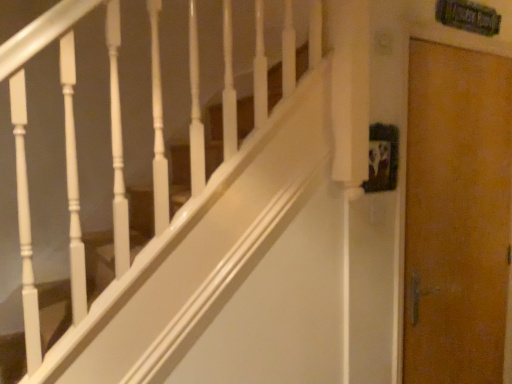
What is the approximate height of wooden door at right?

It is 5.77 feet.

Describe the element at coordinates (456, 215) in the screenshot. I see `wooden door at right` at that location.

What is the approximate width of wooden door at right?

11.66 centimeters.

This screenshot has height=384, width=512. What are the coordinates of `wooden door at right` in the screenshot? It's located at (456, 215).

I want to click on wooden door at right, so click(456, 215).